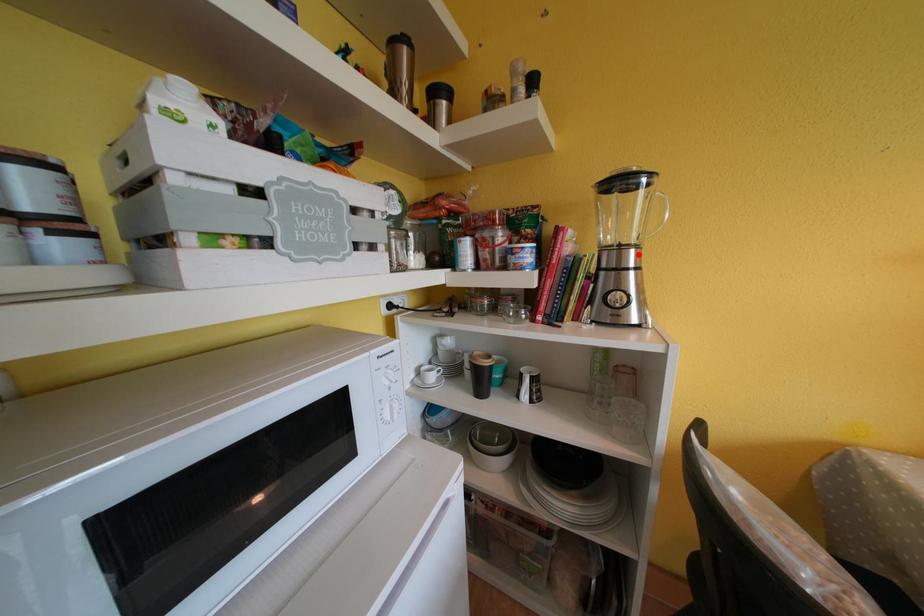
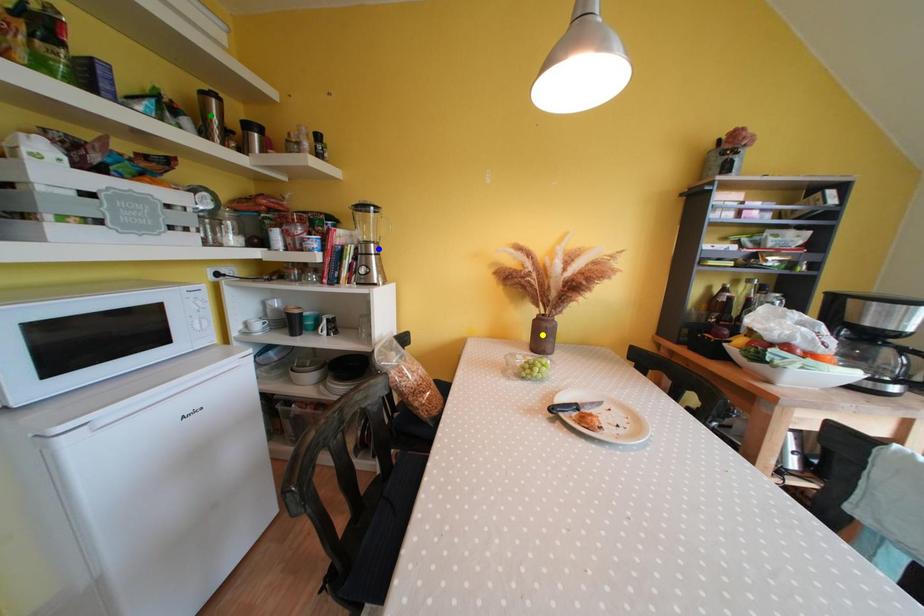
Question: I am providing you with two images of the same scene from different viewpoints. A red point is marked on the first image. You are given multiple points on the second image. Can you choose the point in image 2 that corresponds to the point in image 1?

Choices:
 (A) green point
 (B) yellow point
 (C) blue point

Answer: (C)